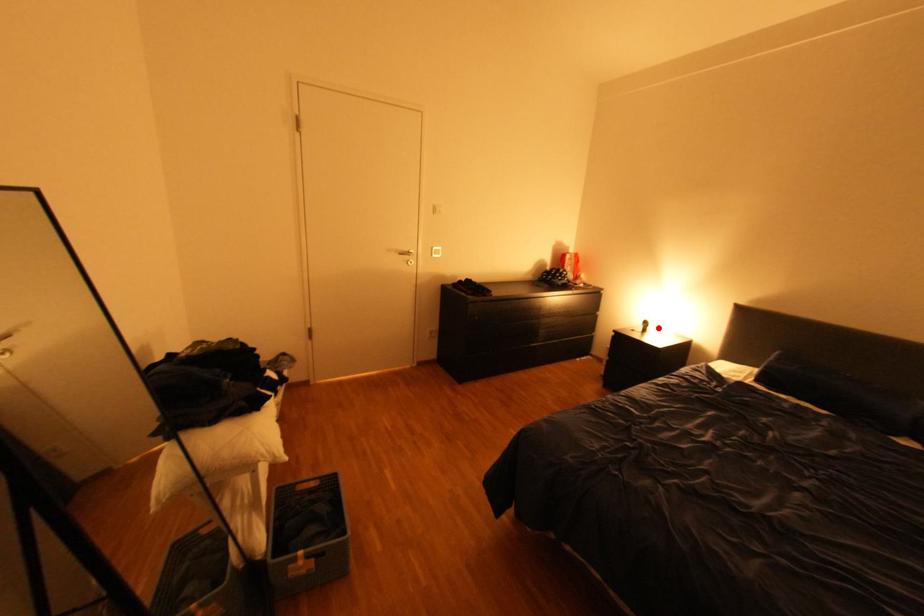
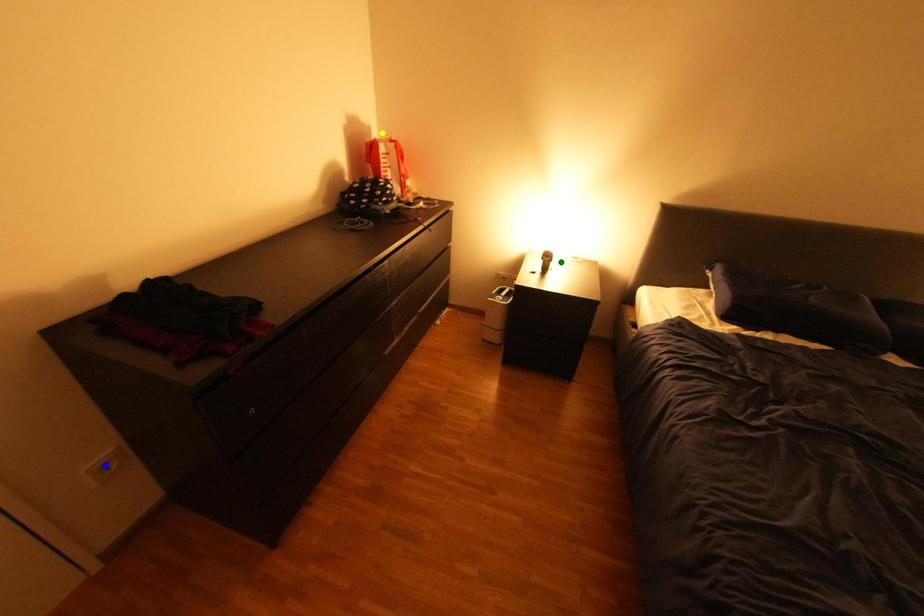
Question: I am providing you with two images of the same scene from different viewpoints. A red point is marked on the first image. You are given multiple points on the second image. Which spot in image 2 lines up with the point in image 1?

Choices:
 (A) blue point
 (B) yellow point
 (C) green point

Answer: (C)